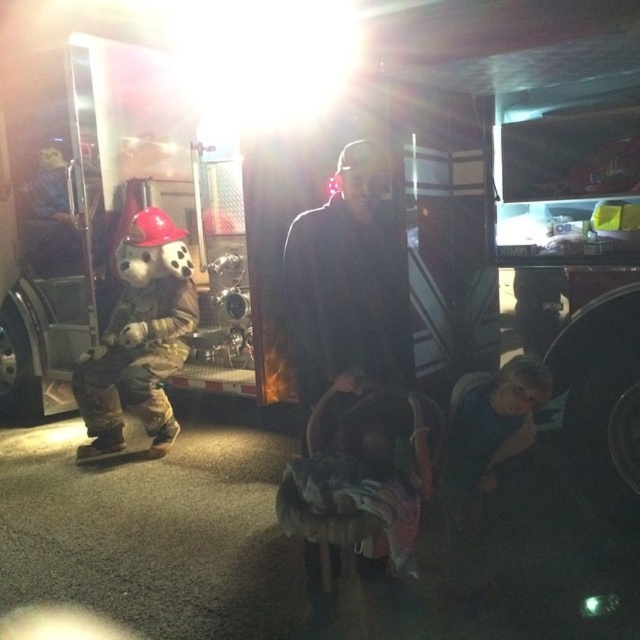
Does point (342, 160) come in front of point (312, 568)?

That is True.

Is point (336, 308) positioned before point (316, 456)?

No, it is behind (316, 456).

I want to click on dark blue fabric at center, so click(x=346, y=288).

Is dark blue fabric at center in front of camouflage fabric costume at left?

Yes, it is.

Is dark blue fabric at center bigger than camouflage fabric costume at left?

No.

The width and height of the screenshot is (640, 640). In order to click on dark blue fabric at center in this screenshot , I will do (x=346, y=288).

Is dark fabric baby carriage at center above camouflage fabric costume at left?

Actually, dark fabric baby carriage at center is below camouflage fabric costume at left.

Does dark fabric baby carriage at center appear under camouflage fabric costume at left?

Indeed, dark fabric baby carriage at center is positioned under camouflage fabric costume at left.

What do you see at coordinates (358, 484) in the screenshot? This screenshot has height=640, width=640. I see `dark fabric baby carriage at center` at bounding box center [358, 484].

The image size is (640, 640). Identify the location of dark fabric baby carriage at center. (358, 484).